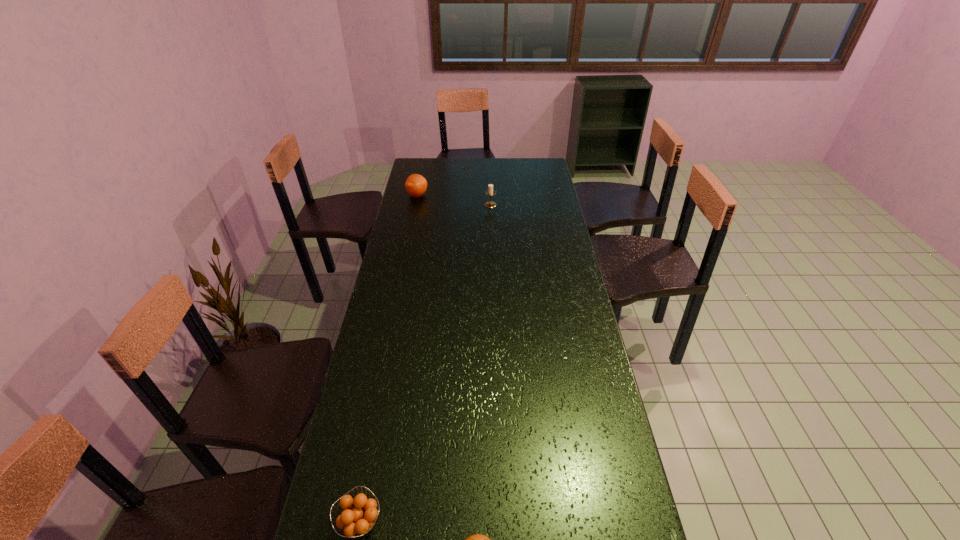
Locate an element on the screen. the farthest orange fruit is located at coordinates (416, 185).

At what (x,y) coordinates should I click in order to perform the action: click on the tallest orange fruit. Please return your answer as a coordinate pair (x, y). This screenshot has width=960, height=540. Looking at the image, I should click on (416, 185).

This screenshot has width=960, height=540. I want to click on the second farthest object, so click(x=490, y=191).

Locate an element on the screen. The image size is (960, 540). free region located 0.170m on the right of the farthest object is located at coordinates (462, 195).

The height and width of the screenshot is (540, 960). Find the location of `vacant space located 0.220m on the left of the candle holder`. vacant space located 0.220m on the left of the candle holder is located at coordinates (440, 205).

Identify the location of object at the left edge. (416, 185).

This screenshot has height=540, width=960. Identify the location of vacant space at the left edge. (400, 214).

In order to click on vacant area at the right edge in this screenshot , I will do `click(566, 413)`.

Identify the location of free region at the far left corner of the desktop. (433, 170).

Image resolution: width=960 pixels, height=540 pixels. What are the coordinates of `vacant space that is in between the farthest object and the second farthest object` in the screenshot? It's located at (454, 200).